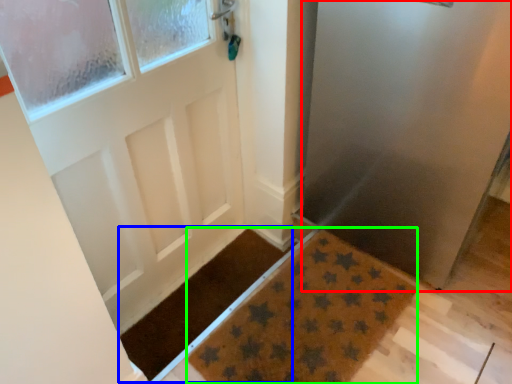
Question: Based on their relative distances, which object is farther from screen door (highlighted by a red box)? Choose from doormat (highlighted by a blue box) and doormat (highlighted by a green box).

Choices:
 (A) doormat
 (B) doormat

Answer: (A)